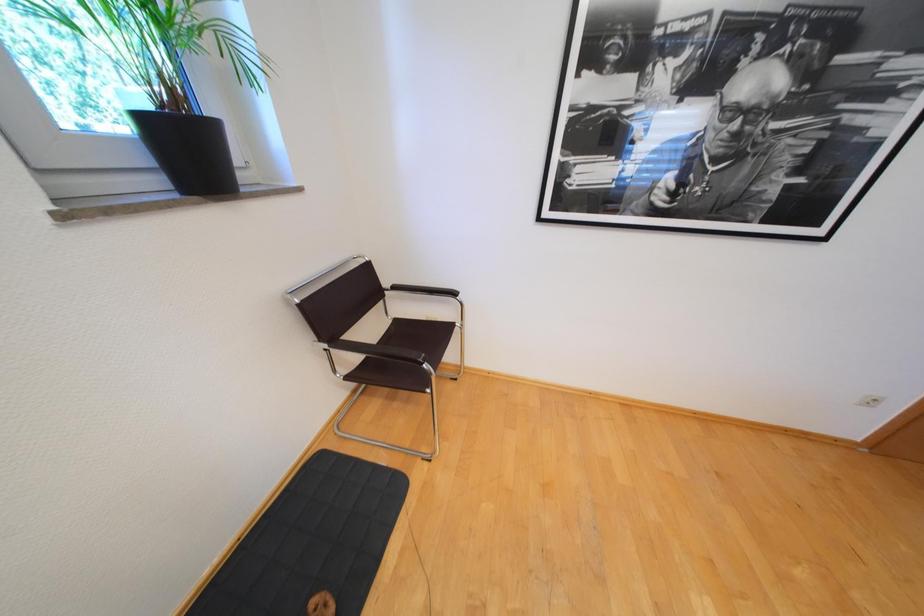
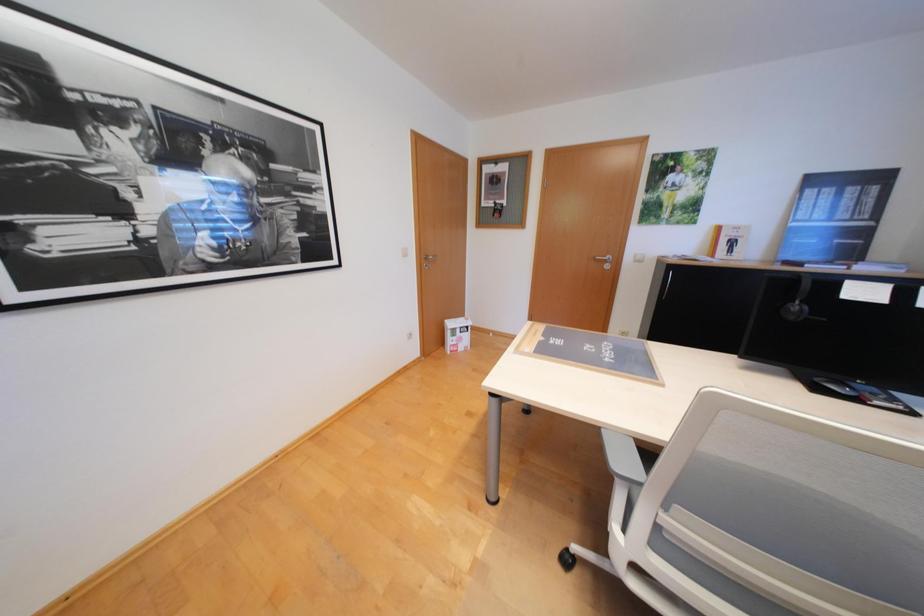
Question: The camera is either moving clockwise (left) or counter-clockwise (right) around the object. The first image is from the beginning of the video and the second image is from the end. Is the camera moving left or right when shooting the video?

Choices:
 (A) Left
 (B) Right

Answer: (A)